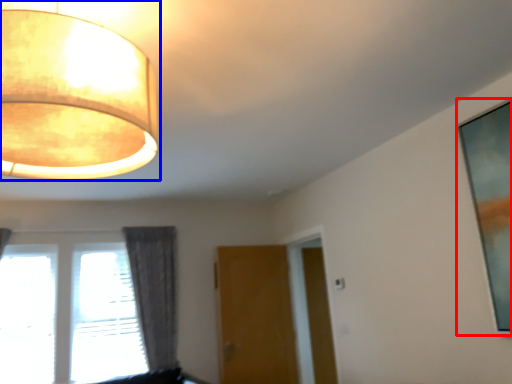
Question: Among these objects, which one is nearest to the camera, picture frame (highlighted by a red box) or lamp (highlighted by a blue box)?

Choices:
 (A) picture frame
 (B) lamp

Answer: (B)